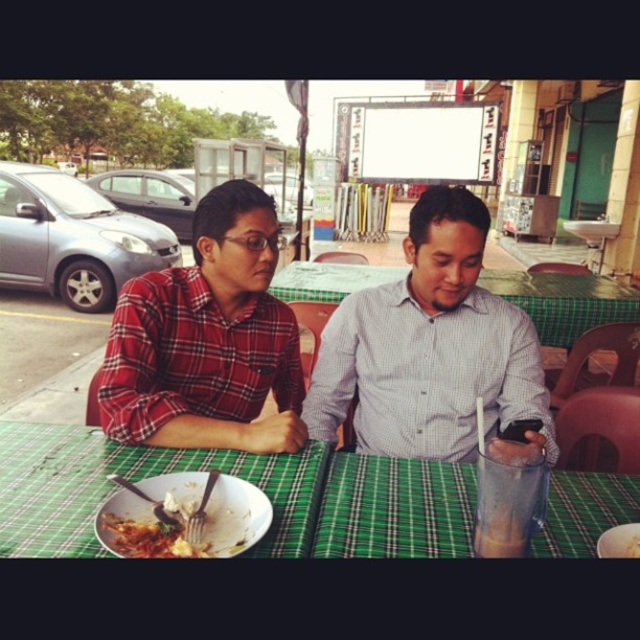
You are a photographer taking a picture of the two people at the table. You need to ensure that both the white checkered shirt at center and the red plaid shirt at left are clearly visible in the frame. Based on their heights, which shirt should you focus on first to ensure proper exposure?

The white checkered shirt at center is taller than the red plaid shirt at left, so you should focus on the white checkered shirt at center first to ensure proper exposure.

You are sitting at the table and want to reach for the red plaid shirt at left. Is the green plaid tablecloth at center blocking your path?

The green plaid tablecloth at center is in front of the red plaid shirt at left, so it would block your path to the red plaid shirt at left.